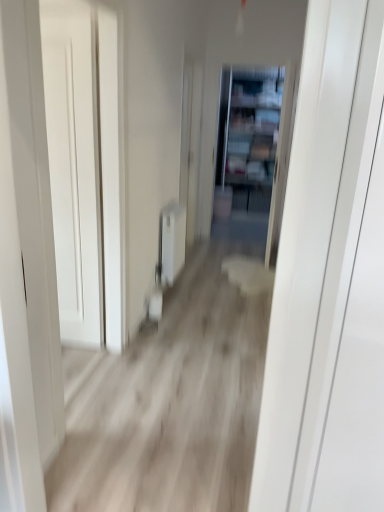
Identify the location of free space above wooden floor at center (from a real-world perspective). coord(190,342).